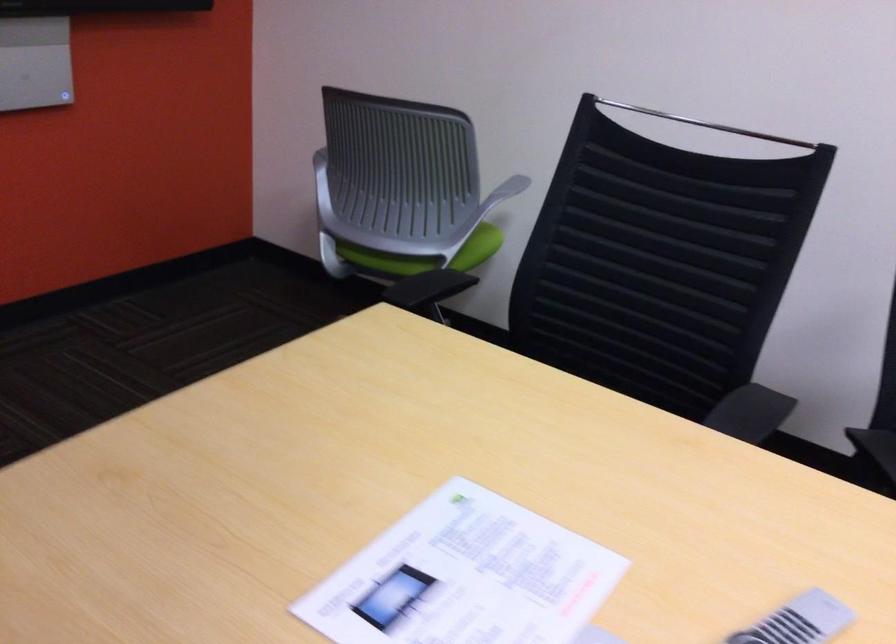
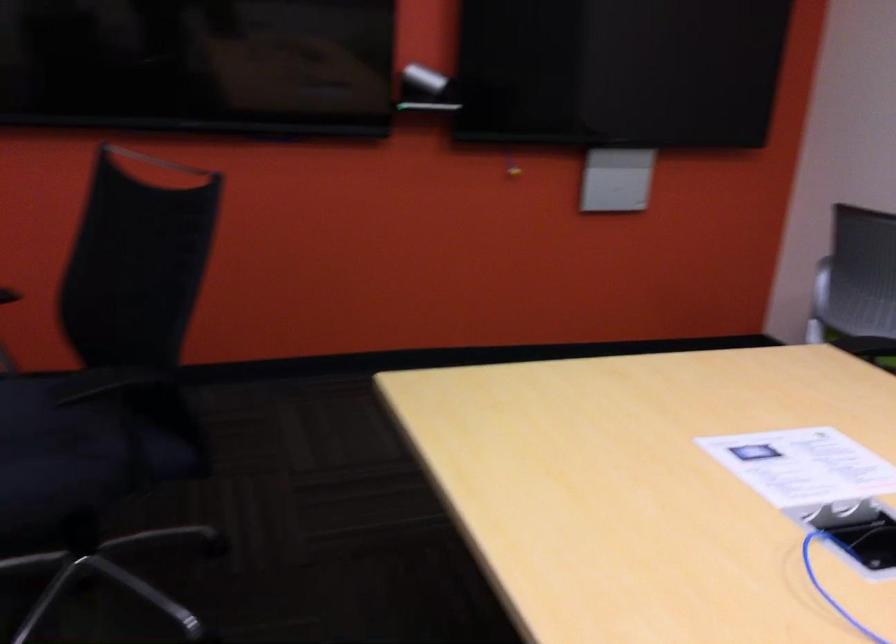
The point at (450, 538) is marked in the first image. Where is the corresponding point in the second image?

(803, 466)